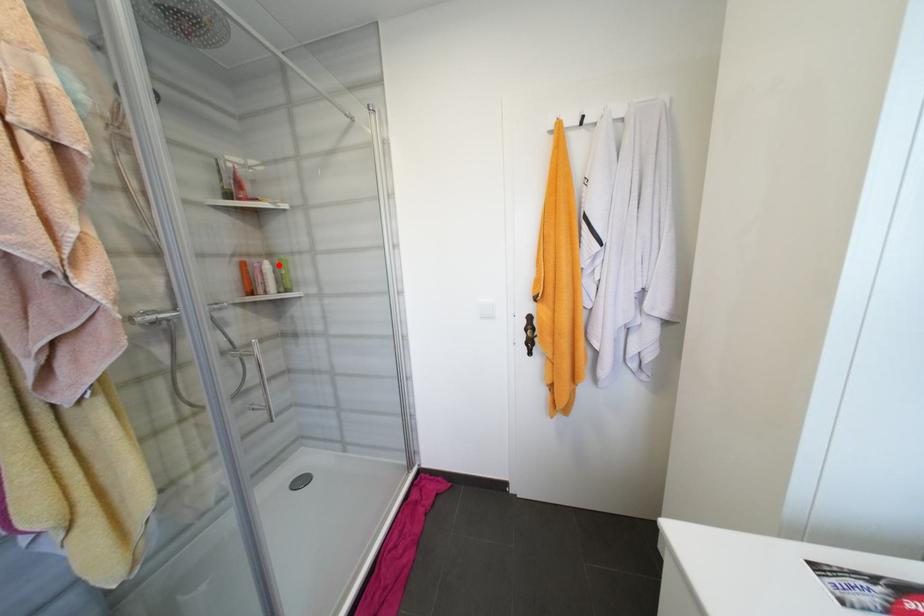
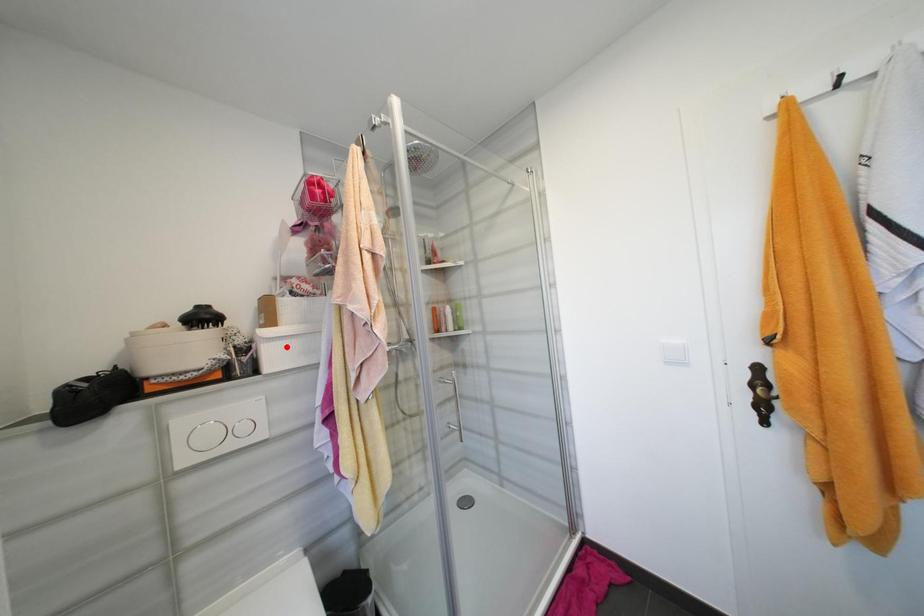
I am providing you with two images of the same scene from different viewpoints. A red point is marked on the first image and another point is marked on the second image. Does the point marked in image1 correspond to the same location as the one in image2?

No